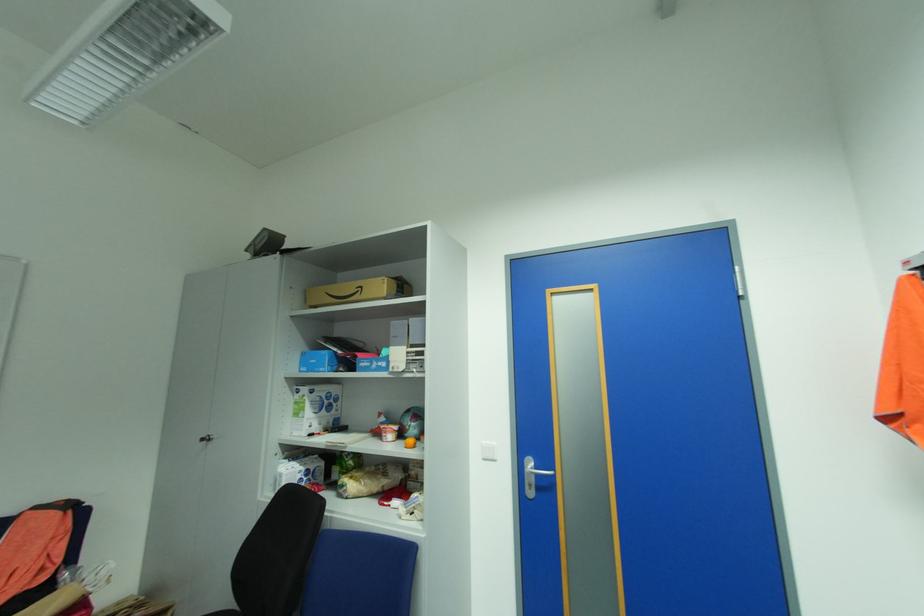
Image resolution: width=924 pixels, height=616 pixels. What do you see at coordinates (358, 291) in the screenshot?
I see `the cardboard box` at bounding box center [358, 291].